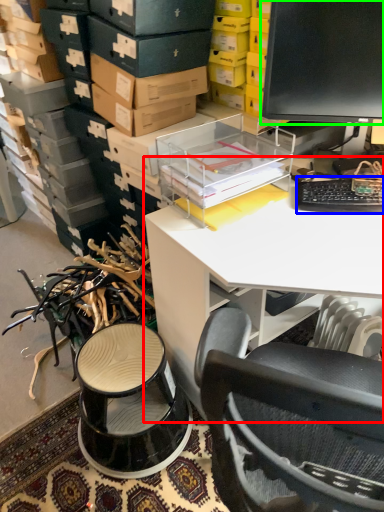
Question: Estimate the real-world distances between objects in this image. Which object is farther from desk (highlighted by a red box), computer keyboard (highlighted by a blue box) or computer monitor (highlighted by a green box)?

Choices:
 (A) computer keyboard
 (B) computer monitor

Answer: (B)